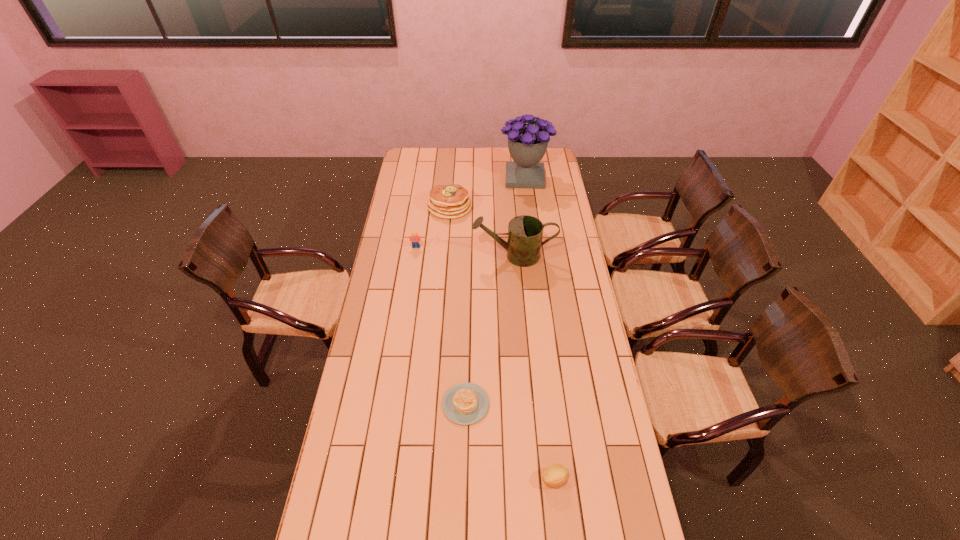
Where is `vacant space that is in between the shortest object and the taller pancake`? vacant space that is in between the shortest object and the taller pancake is located at coordinates (458, 306).

Identify the location of empty space that is in between the second farthest object and the Lego. (433, 227).

Identify the location of vacant area that lies between the farther pancake and the watering can. This screenshot has width=960, height=540. [x=482, y=231].

Locate an element on the screen. The width and height of the screenshot is (960, 540). vacant space that's between the second tallest object and the Lego is located at coordinates (466, 251).

Identify the location of vacant space in between the bouquet and the taller pancake. This screenshot has width=960, height=540. (488, 192).

Identify the location of free space between the taller pancake and the nearest object. The height and width of the screenshot is (540, 960). (502, 343).

Locate an element on the screen. vacant region between the nearest object and the bouquet is located at coordinates (540, 328).

Locate an element on the screen. vacant space in between the farther pancake and the third shortest object is located at coordinates (433, 227).

The image size is (960, 540). I want to click on vacant space that's between the fifth tallest object and the watering can, so click(534, 367).

Identify which object is the nearest to the second farthest object. Please provide its 2D coordinates. Your answer should be formatted as a tuple, i.e. [(x, y)], where the tuple contains the x and y coordinates of a point satisfying the conditions above.

[(527, 143)]